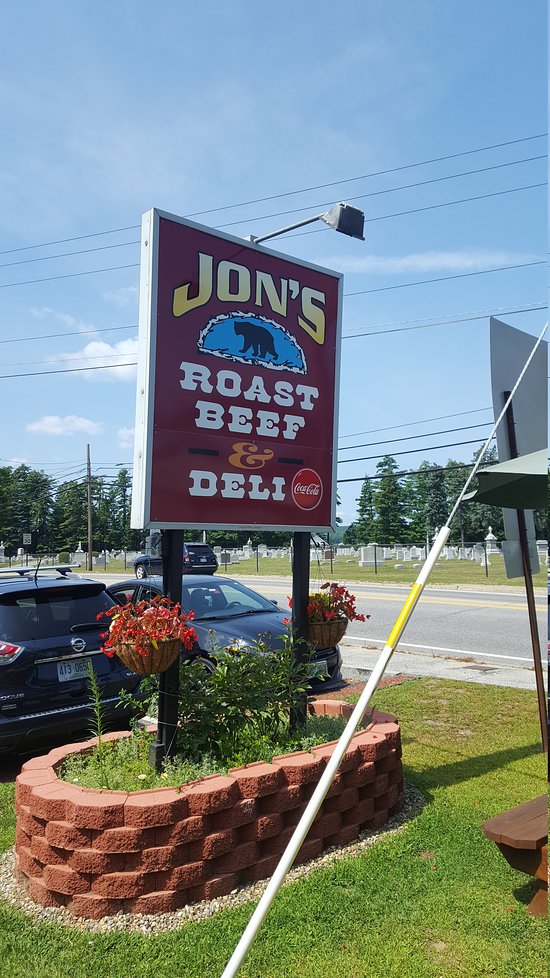
Find the location of `bench`. bench is located at coordinates (512, 822).